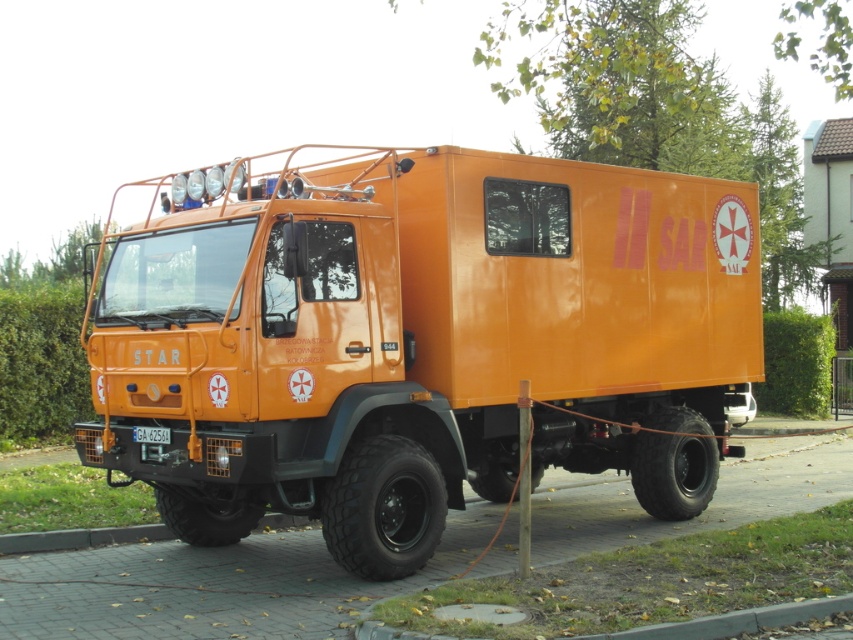
Question: Can you confirm if orange matte truck at center is positioned above white plastic license plate at center?

Choices:
 (A) yes
 (B) no

Answer: (B)

Question: Which of the following is the farthest from the observer?

Choices:
 (A) orange matte truck at center
 (B) white plastic license plate at center

Answer: (B)

Question: Does orange matte truck at center appear on the right side of white plastic license plate at center?

Choices:
 (A) yes
 (B) no

Answer: (A)

Question: Is orange matte truck at center positioned at the back of white plastic license plate at center?

Choices:
 (A) no
 (B) yes

Answer: (A)

Question: Which point appears farthest from the camera in this image?

Choices:
 (A) (520, 333)
 (B) (164, 436)

Answer: (A)

Question: Which point is farther to the camera?

Choices:
 (A) white plastic license plate at center
 (B) orange matte truck at center

Answer: (A)